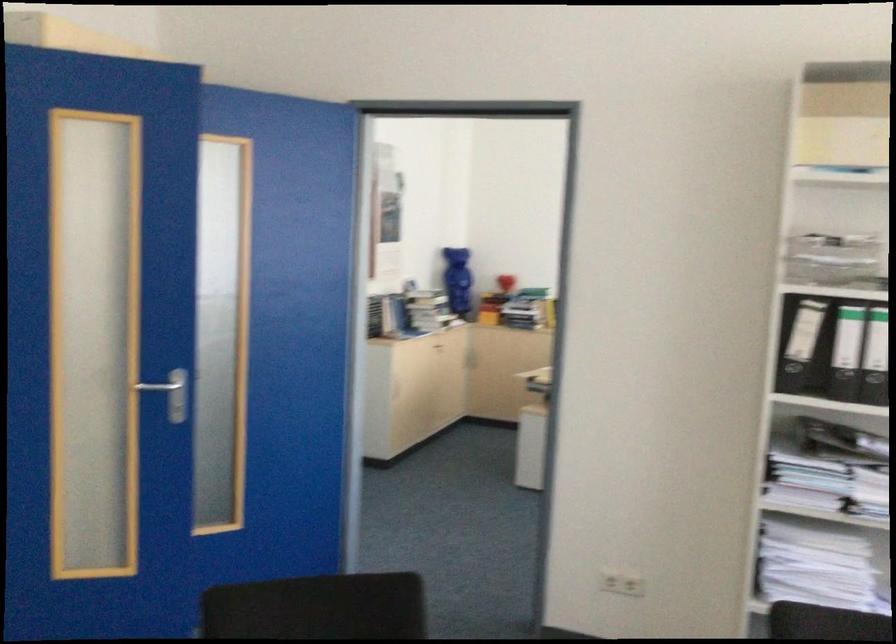
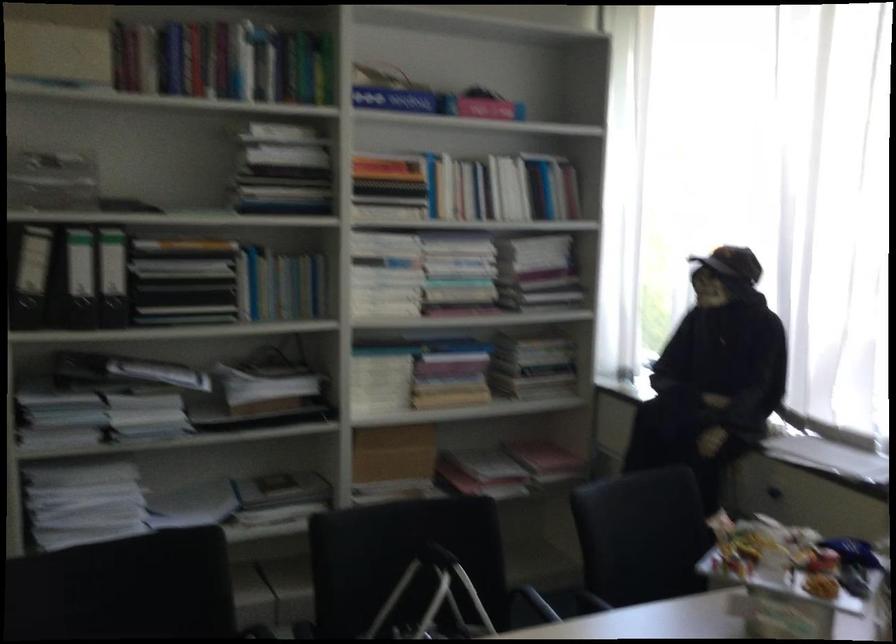
Find the pixel in the second image that matches point (793, 339) in the first image.

(29, 274)